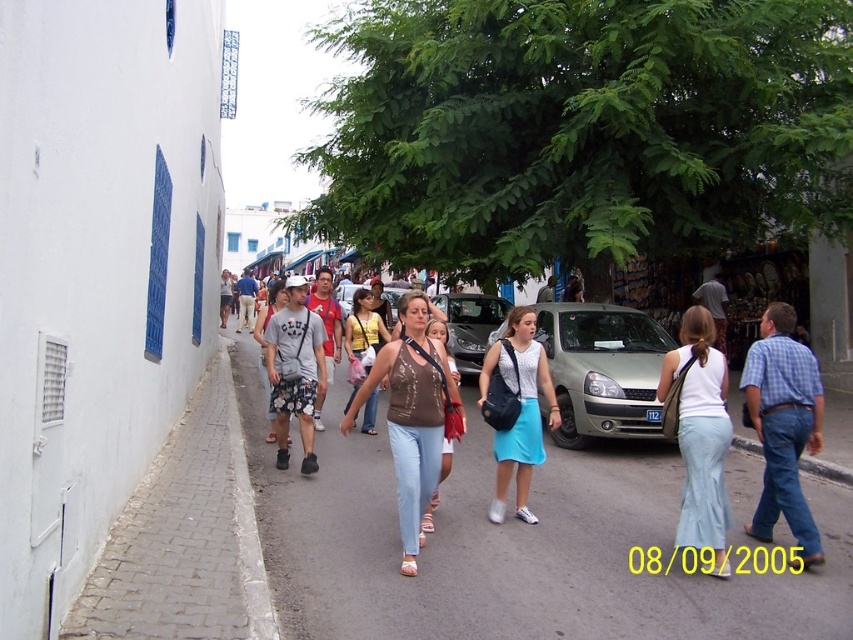
You are standing at the entrance of the street and see the point marked at coordinates (x=700, y=433). What object is located at that point?

The point at coordinates (x=700, y=433) corresponds to the white cotton skirt at center.